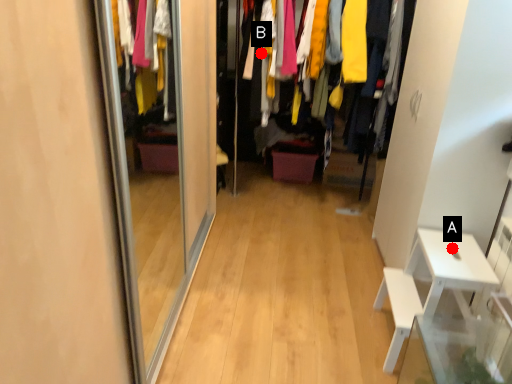
Question: Two points are circled on the image, labeled by A and B beside each circle. Which point appears farthest from the camera in this image?

Choices:
 (A) A is further
 (B) B is further

Answer: (B)